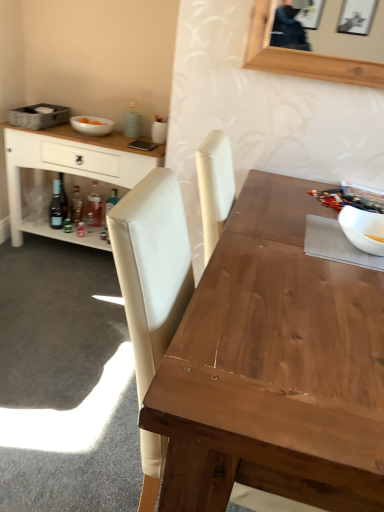
Locate an element on the screen. The height and width of the screenshot is (512, 384). free location in front of white glossy bowl at upper right, which ranks as the first bowl in bottom-to-top order is located at coordinates (364, 280).